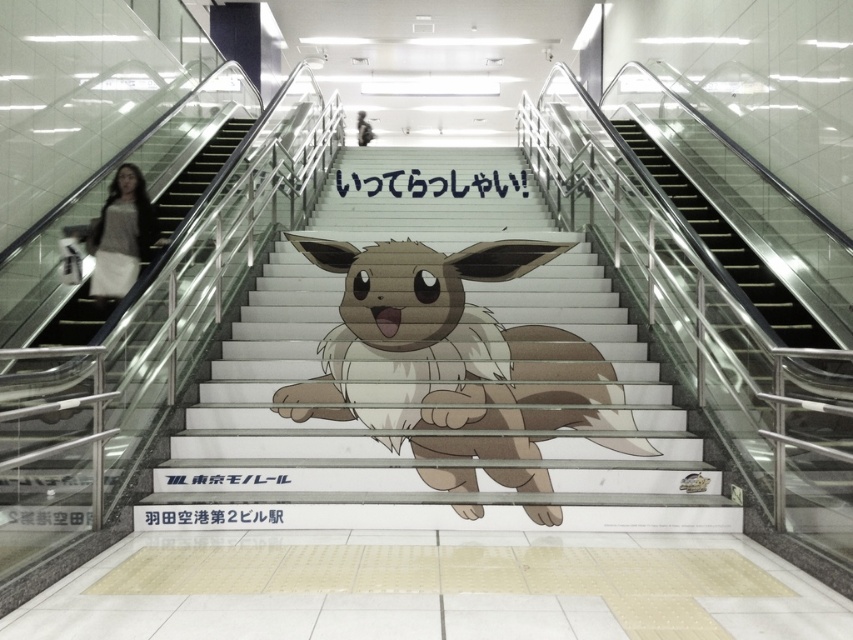
You are standing in the modern train station depicted in the image. You need to locate the brown furry stairs at center. According to the coordinates provided, where exactly would you find them?

The brown furry stairs at center are located at the coordinates point (434, 374).

You are standing in the modern train station depicted in the image. You see a light brown sweater at left. Where is the light brown sweater located in relation to the stairs with the Eevee illustration?

The light brown sweater at left is located at point coordinates 0.367 along the x axis and 0.143 along the y axis.